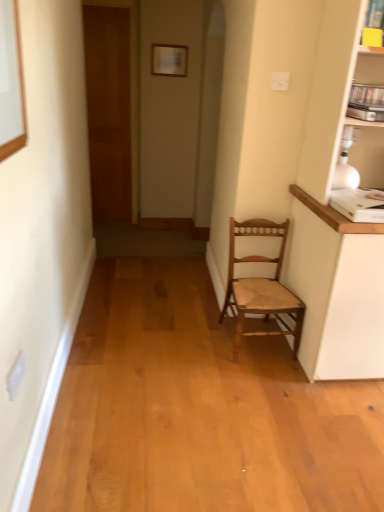
Question: Would you say matte white picture frame at upper center is part of wooden door at left's contents?

Choices:
 (A) no
 (B) yes

Answer: (A)

Question: Can you confirm if wooden door at left is positioned to the left of matte white picture frame at upper center?

Choices:
 (A) no
 (B) yes

Answer: (B)

Question: Is wooden door at left to the right of matte white picture frame at upper center from the viewer's perspective?

Choices:
 (A) yes
 (B) no

Answer: (B)

Question: Is wooden door at left oriented away from matte white picture frame at upper center?

Choices:
 (A) no
 (B) yes

Answer: (A)

Question: From a real-world perspective, is wooden door at left physically below matte white picture frame at upper center?

Choices:
 (A) yes
 (B) no

Answer: (A)

Question: Considering the relative sizes of wooden door at left and matte white picture frame at upper center in the image provided, is wooden door at left smaller than matte white picture frame at upper center?

Choices:
 (A) yes
 (B) no

Answer: (B)

Question: Is wooden chair at center bigger than matte white picture frame at upper center?

Choices:
 (A) no
 (B) yes

Answer: (B)

Question: Does wooden chair at center turn towards matte white picture frame at upper center?

Choices:
 (A) yes
 (B) no

Answer: (B)

Question: Considering the relative positions of wooden chair at center and matte white picture frame at upper center in the image provided, is wooden chair at center behind matte white picture frame at upper center?

Choices:
 (A) no
 (B) yes

Answer: (A)

Question: Is wooden chair at center at the right side of matte white picture frame at upper center?

Choices:
 (A) no
 (B) yes

Answer: (B)

Question: Is wooden chair at center positioned in front of matte white picture frame at upper center?

Choices:
 (A) no
 (B) yes

Answer: (B)

Question: From a real-world perspective, is wooden chair at center over matte white picture frame at upper center?

Choices:
 (A) no
 (B) yes

Answer: (A)

Question: Does matte white picture frame at upper center have a greater height compared to wooden door at left?

Choices:
 (A) yes
 (B) no

Answer: (B)